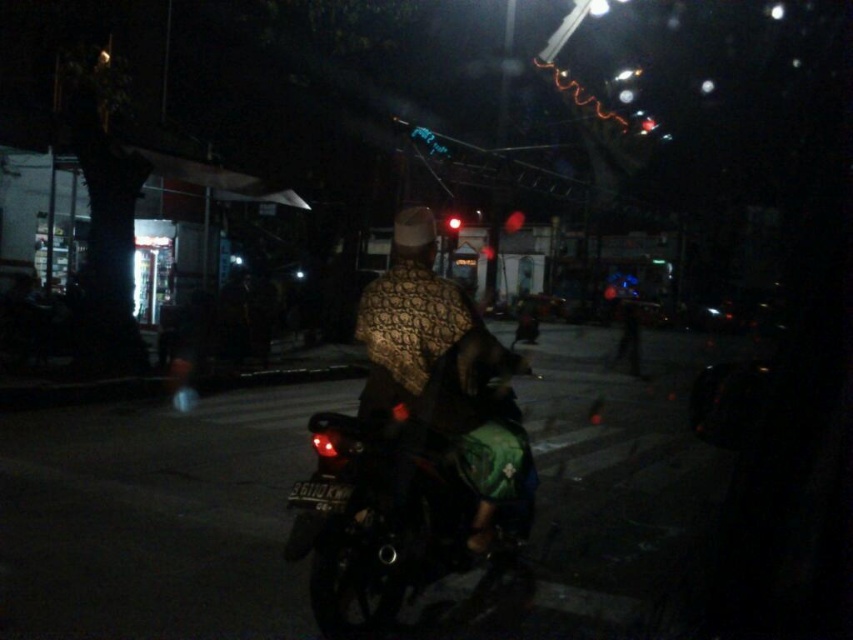
Question: Which object is farther from the camera taking this photo?

Choices:
 (A) red glass traffic light at center
 (B) shiny black motorcycle at center

Answer: (A)

Question: Is patterned fabric at center further to the viewer compared to red glass traffic light at center?

Choices:
 (A) yes
 (B) no

Answer: (B)

Question: From the image, what is the correct spatial relationship of shiny black motorcycle at center in relation to patterned fabric at center?

Choices:
 (A) above
 (B) below

Answer: (B)

Question: Is shiny black motorcycle at center wider than patterned fabric at center?

Choices:
 (A) yes
 (B) no

Answer: (A)

Question: Which point is farther to the camera?

Choices:
 (A) patterned fabric at center
 (B) shiny black motorcycle at center
 (C) red glass traffic light at center

Answer: (C)

Question: Which point is closer to the camera?

Choices:
 (A) shiny black motorcycle at center
 (B) red glass traffic light at center
 (C) patterned fabric at center

Answer: (A)